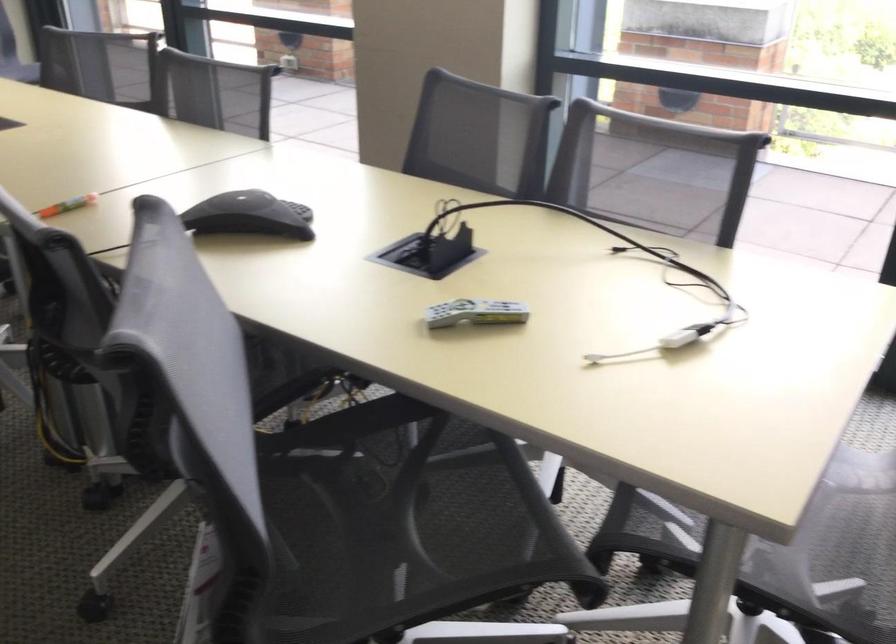
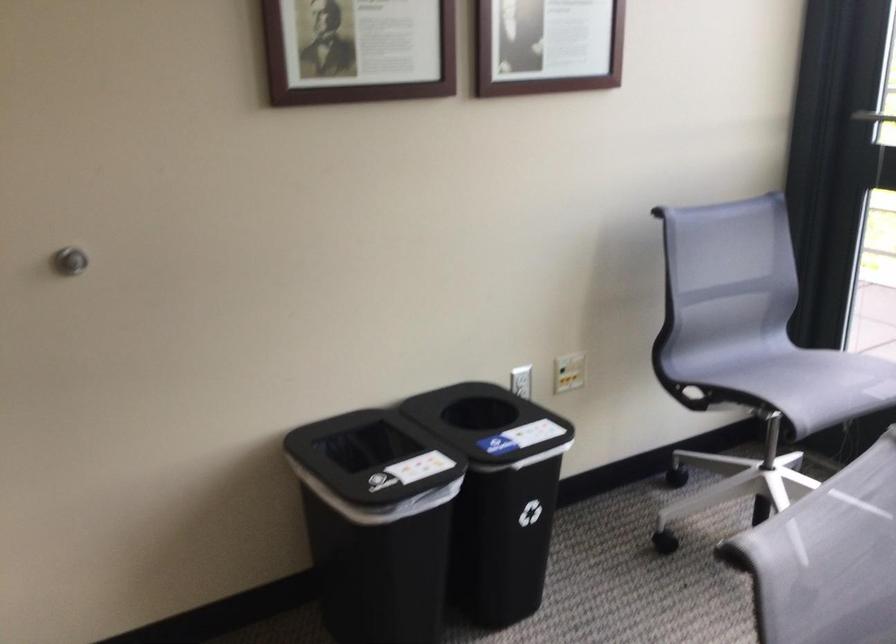
The images are taken continuously from a first-person perspective. In which direction are you moving?

The cameraman walked toward left, forward.